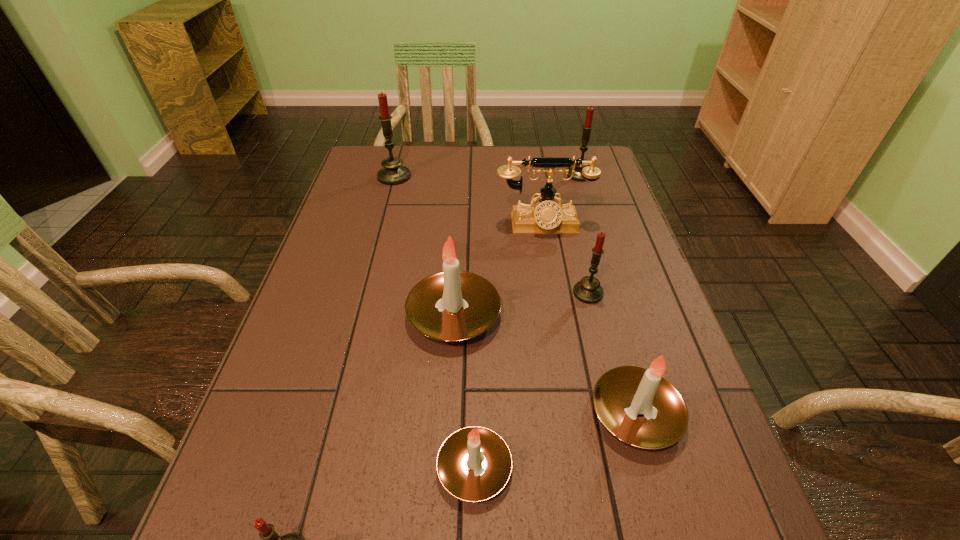
Locate an element on the screen. The width and height of the screenshot is (960, 540). free space at the far edge is located at coordinates (545, 150).

Find the location of a particular element. Image resolution: width=960 pixels, height=540 pixels. free location at the left edge is located at coordinates pos(291,446).

Find the location of a particular element. Image resolution: width=960 pixels, height=540 pixels. blank space at the right edge of the desktop is located at coordinates (617, 260).

Identify the location of vacant space at the near right corner of the desktop. (710, 534).

In order to click on vacant space in between the telephone and the second smallest red candle in this screenshot , I will do `click(565, 259)`.

Find the location of a particular element. The height and width of the screenshot is (540, 960). vacant point located between the tallest candle and the farthest white candle is located at coordinates (424, 246).

At what (x,y) coordinates should I click in order to perform the action: click on free area in between the beige telephone and the biggest white candle. Please return your answer as a coordinate pair (x, y). The image size is (960, 540). Looking at the image, I should click on (498, 270).

Locate an element on the screen. This screenshot has width=960, height=540. free space that is in between the telephone and the third smallest red candle is located at coordinates (562, 200).

Identify the location of free space between the smallest white candle and the third smallest red candle. The image size is (960, 540). point(527,321).

Identify the location of free spot between the third farthest red candle and the smallest white candle. This screenshot has height=540, width=960. (531, 380).